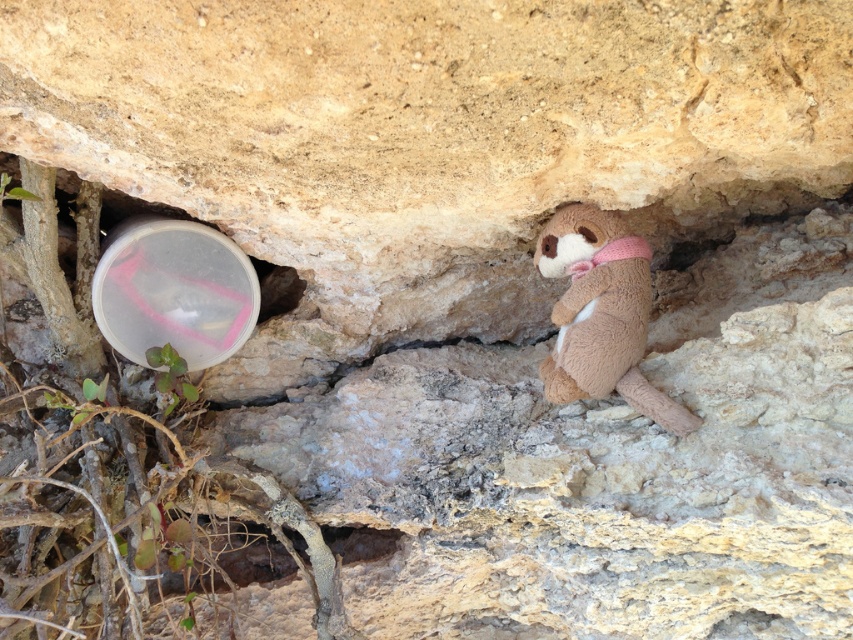
Does transparent plastic bubble at lower left appear on the right side of smooth stone hole at center?

No, transparent plastic bubble at lower left is not to the right of smooth stone hole at center.

Which is more to the left, transparent plastic bubble at lower left or smooth stone hole at center?

transparent plastic bubble at lower left is more to the left.

Who is more distant from viewer, (x=200, y=227) or (x=384, y=540)?

The point (x=384, y=540) is behind.

This screenshot has width=853, height=640. I want to click on transparent plastic bubble at lower left, so pos(173,291).

Which is more to the left, brown plush toy at center or smooth stone hole at center?

From the viewer's perspective, smooth stone hole at center appears more on the left side.

Is brown plush toy at center wider than smooth stone hole at center?

Yes.

Between point (573, 365) and point (335, 552), which one is positioned in front?

Point (573, 365) is more forward.

Identify the location of brown plush toy at center. Image resolution: width=853 pixels, height=640 pixels. (601, 314).

Is transparent plastic bubble at lower left to the right of brown plush toy at center from the viewer's perspective?

Incorrect, transparent plastic bubble at lower left is not on the right side of brown plush toy at center.

Measure the distance between point (160,314) and camera.

They are 1.58 meters apart.

Is point (189, 305) less distant than point (566, 292)?

No, (189, 305) is further to viewer.

This screenshot has height=640, width=853. I want to click on transparent plastic bubble at lower left, so click(173, 291).